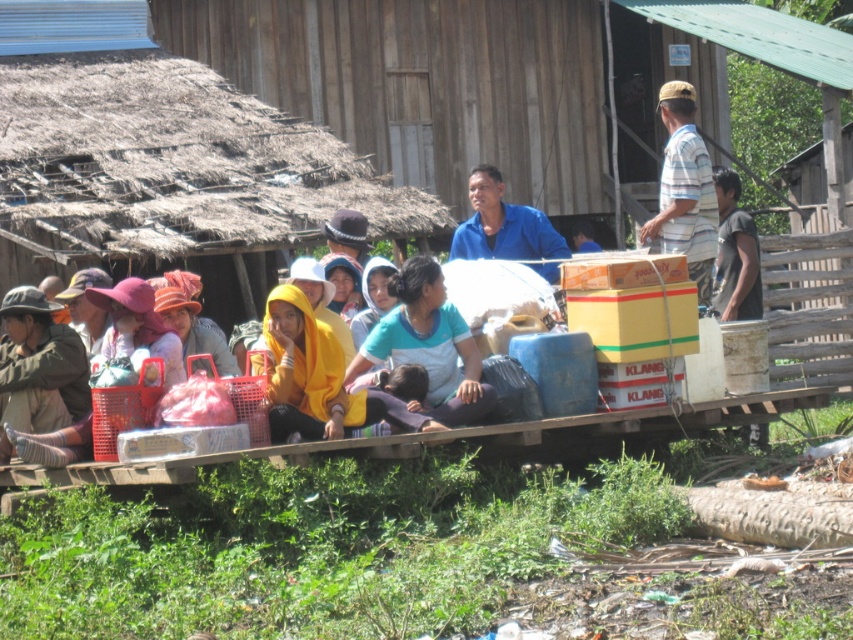
Question: Estimate the real-world distances between objects in this image. Which object is closer to the blue fabric bag at center?

Choices:
 (A) light blue cotton shirt at center
 (B) white striped shirt at upper right
 (C) dark gray t-shirt at right
 (D) blue matte shirt at center

Answer: (B)

Question: Where is blue matte shirt at center located in relation to blue fabric bag at center in the image?

Choices:
 (A) right
 (B) left

Answer: (B)

Question: Is blue matte shirt at center behind dark gray t-shirt at right?

Choices:
 (A) no
 (B) yes

Answer: (A)

Question: Does white striped shirt at upper right appear on the left side of dark gray t-shirt at right?

Choices:
 (A) no
 (B) yes

Answer: (B)

Question: Among these objects, which one is farthest from the camera?

Choices:
 (A) light blue cotton shirt at center
 (B) blue matte shirt at center
 (C) white striped shirt at upper right

Answer: (B)

Question: Which of the following is the farthest from the observer?

Choices:
 (A) (664, 241)
 (B) (488, 248)

Answer: (B)